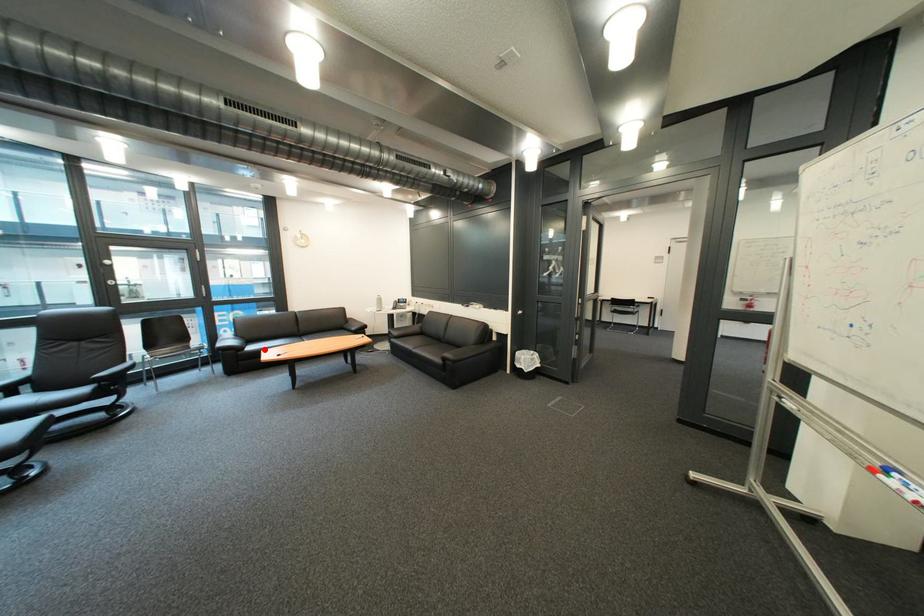
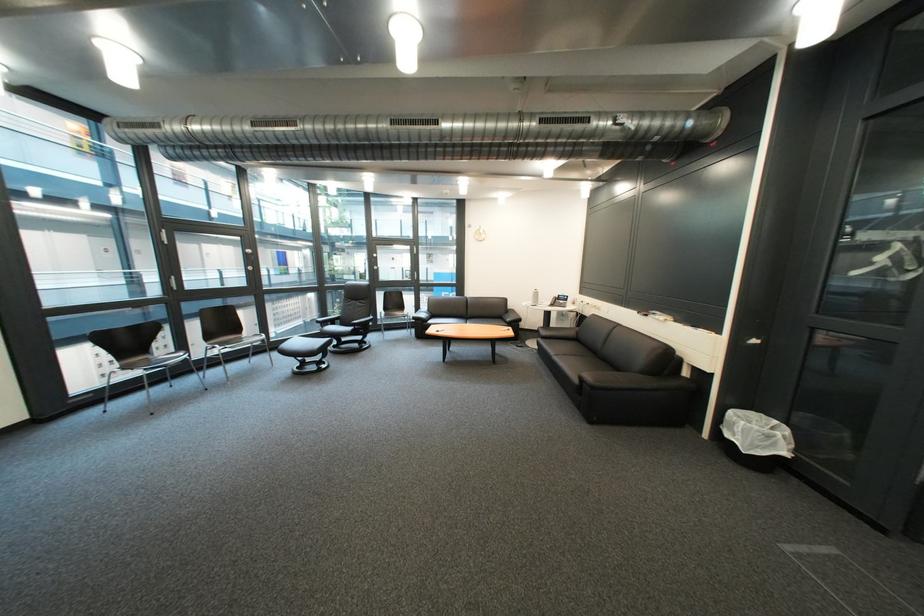
Question: I am providing you with two images of the same scene from different viewpoints. Given a red point in image1, look at the same physical point in image2. Is it:

Choices:
 (A) Closer to the viewpoint
 (B) Farther from the viewpoint

Answer: (B)